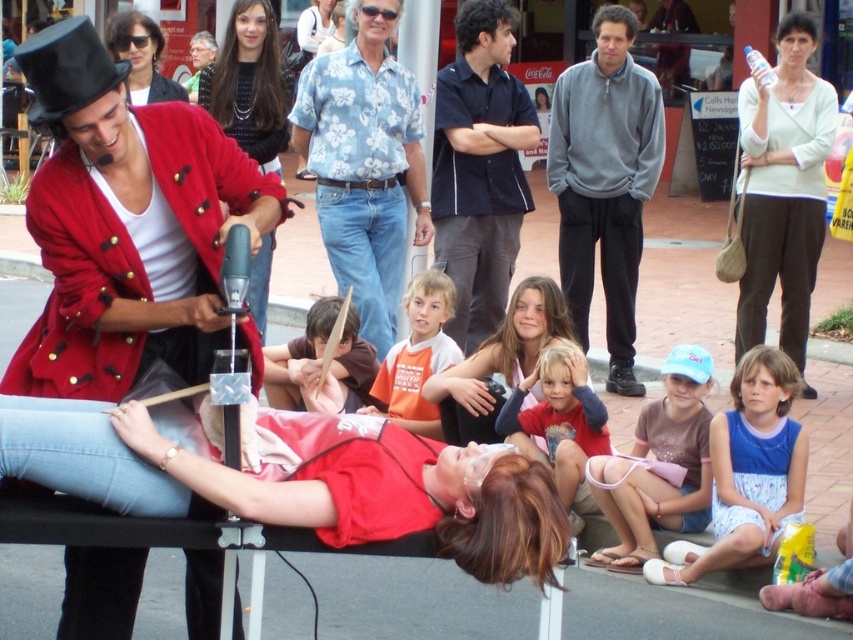
Question: Does blue floral shirt at center appear on the right side of red cotton shirt at lower center?

Choices:
 (A) no
 (B) yes

Answer: (A)

Question: Does gray fleece sweatshirt at center have a lesser width compared to brown fabric shirt at center?

Choices:
 (A) yes
 (B) no

Answer: (B)

Question: Which point is closer to the camera?

Choices:
 (A) matte orange shirt at center
 (B) orange cotton shirt at center

Answer: (A)

Question: Which object appears closest to the camera in this image?

Choices:
 (A) blue denim shorts at lower center
 (B) red cotton shirt at lower center
 (C) red velvet coat at center
 (D) matte black sunglasses at upper left

Answer: (C)

Question: Is red velvet coat at center closer to camera compared to orange cotton shirt at center?

Choices:
 (A) yes
 (B) no

Answer: (A)

Question: Which object is positioned closest to the dark blue shirt at center?

Choices:
 (A) orange cotton shirt at center
 (B) matte orange shirt at center
 (C) blue floral shirt at center
 (D) brown fabric shirt at center

Answer: (C)